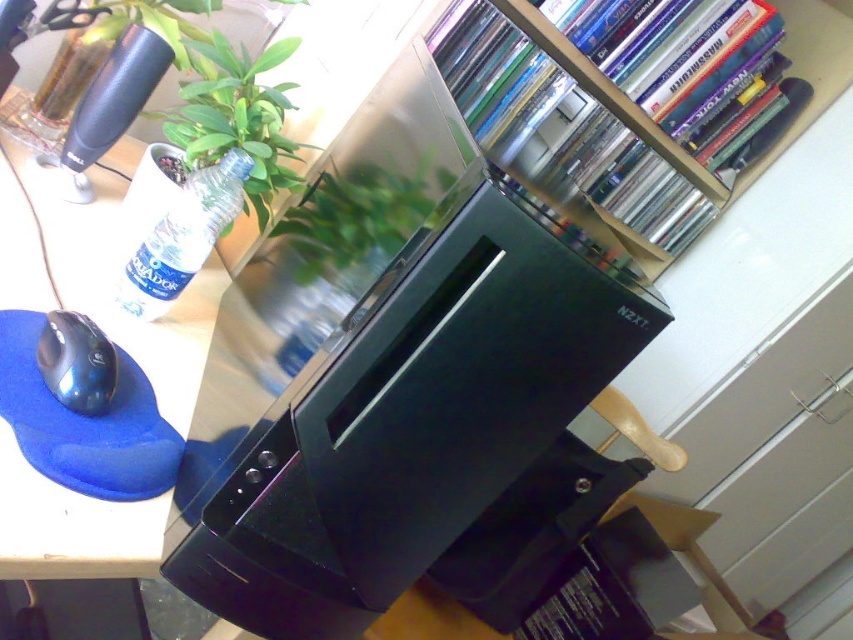
Measure the distance between point (277, 49) and camera.

They are 38.96 inches apart.

Is point (253, 108) positioned after point (86, 374)?

Yes, point (253, 108) is behind point (86, 374).

What are the coordinates of `green leafy plant at upper left` in the screenshot? It's located at (236, 116).

Does black plastic computer case at center appear over clear plastic bottle at upper left?

Actually, black plastic computer case at center is below clear plastic bottle at upper left.

What do you see at coordinates (396, 378) in the screenshot?
I see `black plastic computer case at center` at bounding box center [396, 378].

Image resolution: width=853 pixels, height=640 pixels. Describe the element at coordinates (396, 378) in the screenshot. I see `black plastic computer case at center` at that location.

I want to click on black plastic computer case at center, so click(396, 378).

What do you see at coordinates (61, 232) in the screenshot? I see `blue foam mousepad at lower left` at bounding box center [61, 232].

Is blue foam mousepad at lower left positioned before green leafy plant at upper left?

Yes, it is in front of green leafy plant at upper left.

Identify the location of blue foam mousepad at lower left. (61, 232).